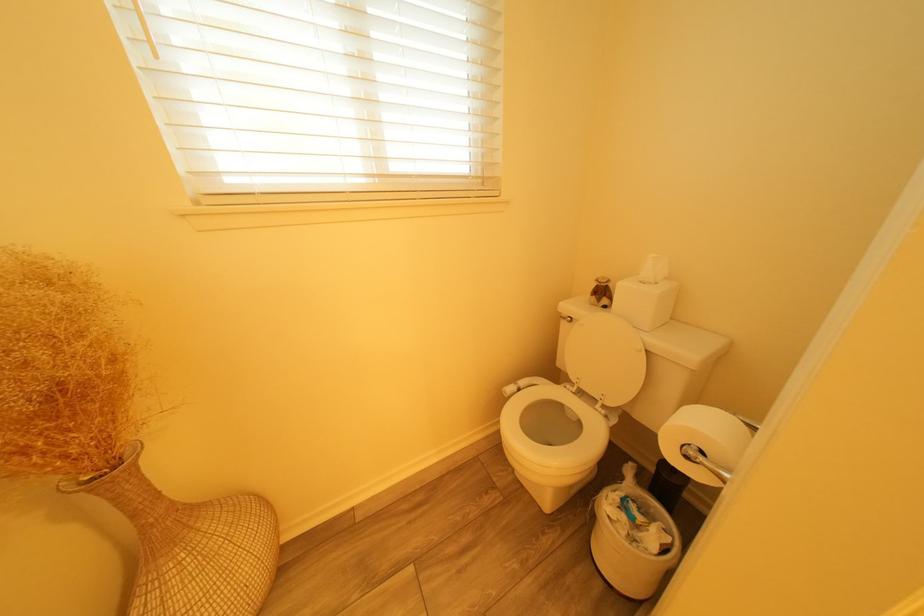
The width and height of the screenshot is (924, 616). In order to click on dispenser pump top in this screenshot , I will do `click(601, 293)`.